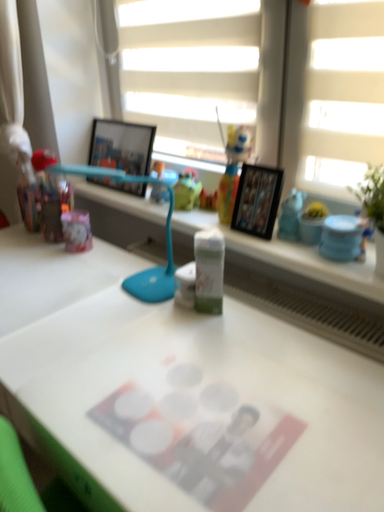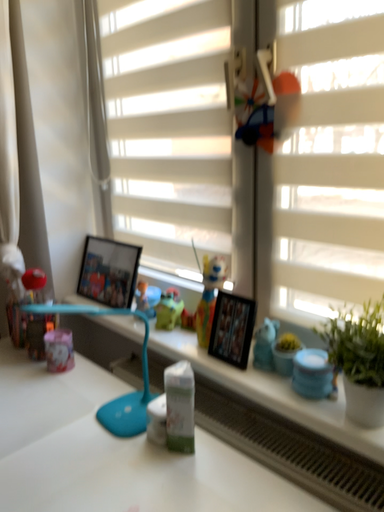
Question: Which way did the camera rotate in the video?

Choices:
 (A) rotated upward
 (B) rotated downward

Answer: (A)